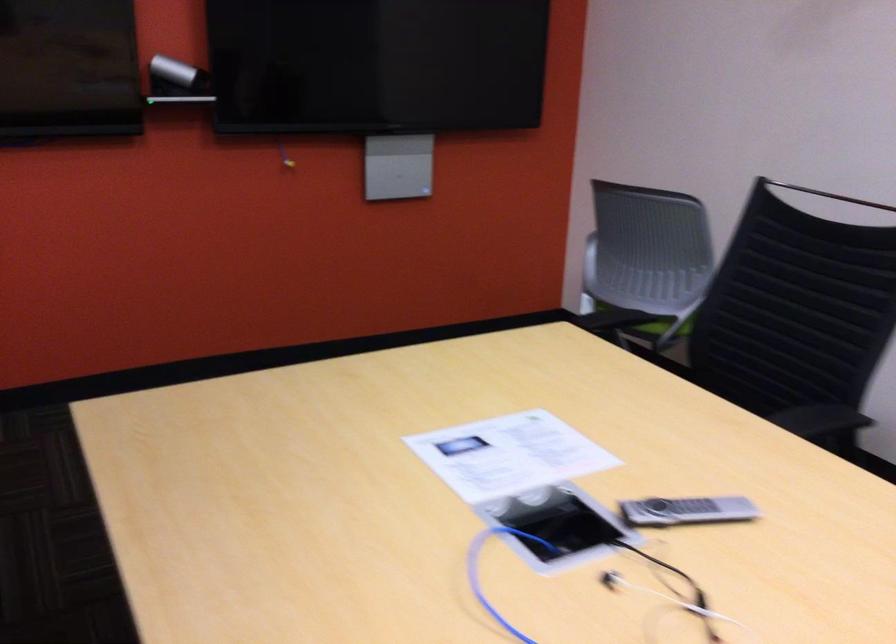
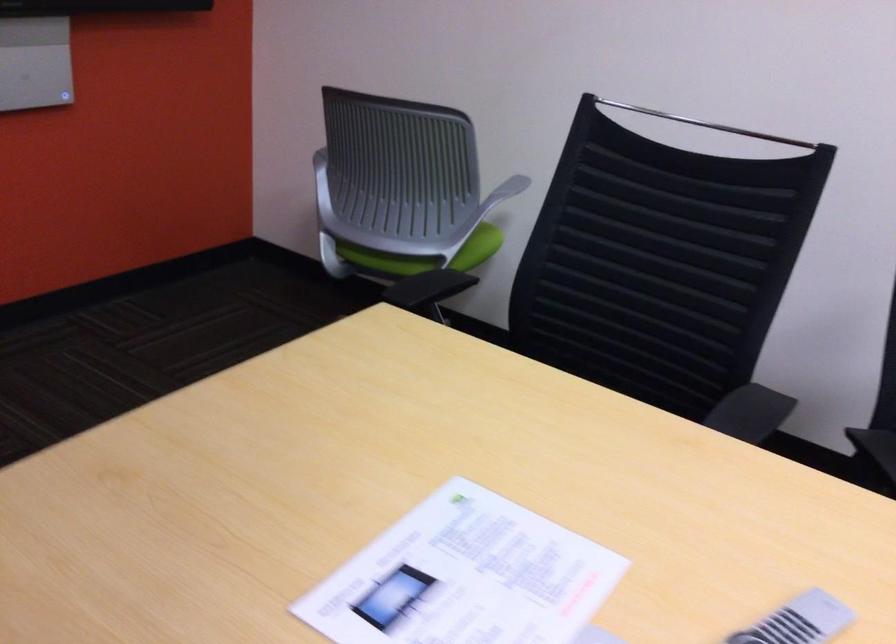
Question: The images are taken continuously from a first-person perspective. In which direction is your viewpoint rotating?

Choices:
 (A) Left
 (B) Right
 (C) Up
 (D) Down

Answer: (B)